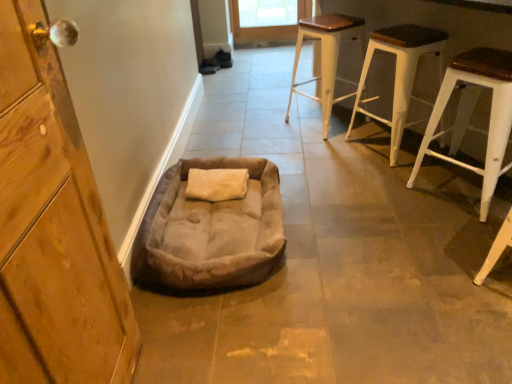
Question: Based on their positions, is white wood stool at upper right, placed as the 2th stool when sorted from left to right, located to the left or right of wooden door at left?

Choices:
 (A) left
 (B) right

Answer: (B)

Question: Does point (398, 102) appear closer or farther from the camera than point (28, 125)?

Choices:
 (A) closer
 (B) farther

Answer: (B)

Question: Based on their relative distances, which object is nearer to the wooden door at left?

Choices:
 (A) white wood stool at right, which appears as the first stool when viewed from the right
 (B) white wood stool at upper right, acting as the third stool starting from the right
 (C) white wood stool at upper right, which ranks as the 2th stool in right-to-left order
 (D) suede-like beige dog bed at lower center

Answer: (D)

Question: Estimate the real-world distances between objects in this image. Which object is closer to the white wood stool at upper right, which is the 1th stool from left to right?

Choices:
 (A) white wood stool at right, the 3th stool from the left
 (B) suede-like beige dog bed at lower center
 (C) wooden door at left
 (D) white wood stool at upper right, which ranks as the 2th stool in right-to-left order

Answer: (D)